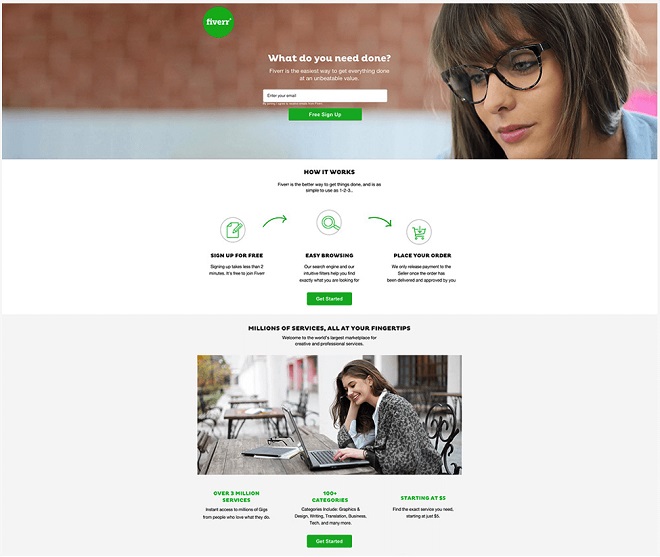
The width and height of the screenshot is (660, 557). Identify the location of laptop. (323, 457).